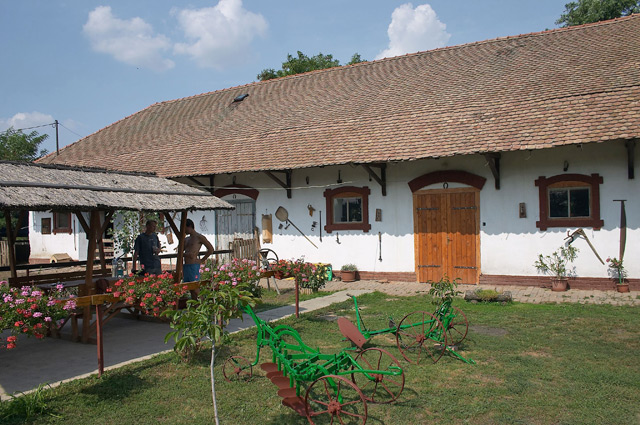
Where is `windows`? windows is located at coordinates (582, 203), (557, 203), (358, 204), (340, 211).